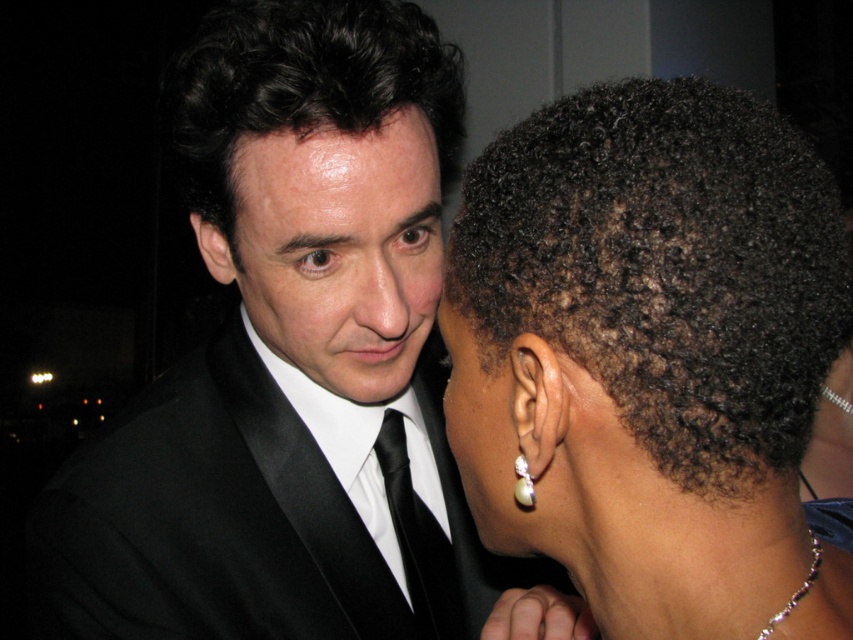
Question: Which object is positioned farthest from the black silk suit at center?

Choices:
 (A) dark curly hair at right
 (B) shiny skin forehead at upper center
 (C) black satin suit at center

Answer: (A)

Question: Is dark curly hair at right closer to camera compared to smooth black suit at center?

Choices:
 (A) yes
 (B) no

Answer: (A)

Question: Which object is the closest to the dark curly hair at right?

Choices:
 (A) pearl earrings at center
 (B) pearlelegantearring at ear
 (C) shiny skin forehead at upper center

Answer: (A)

Question: Which object is farther from the camera taking this photo?

Choices:
 (A) pearlelegantearring at ear
 (B) pearl earring at right

Answer: (A)

Question: Considering the relative positions of dark curly hair at right and pearlelegantearring at ear in the image provided, where is dark curly hair at right located with respect to pearlelegantearring at ear?

Choices:
 (A) above
 (B) below

Answer: (A)

Question: Does black silk suit at center appear under dark curly hair at upper left?

Choices:
 (A) no
 (B) yes

Answer: (B)